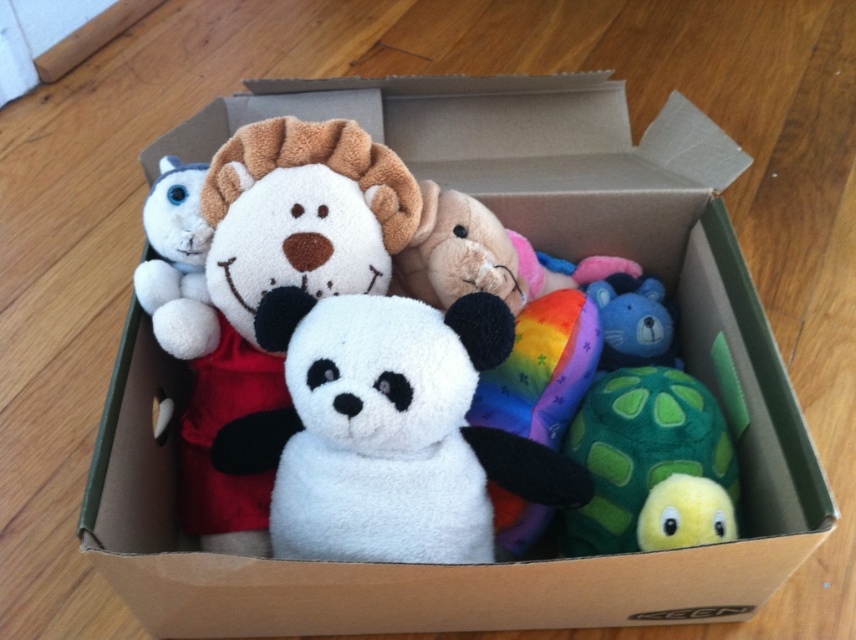
Question: Can you confirm if green fuzzy turtle at lower right is positioned to the left of blue plush bear at center?

Choices:
 (A) no
 (B) yes

Answer: (B)

Question: Considering the relative positions of green fuzzy turtle at lower right and blue plush bear at center in the image provided, where is green fuzzy turtle at lower right located with respect to blue plush bear at center?

Choices:
 (A) left
 (B) right

Answer: (A)

Question: Which object is the farthest from the fluffy white teddy bear at center?

Choices:
 (A) white plush panda at center
 (B) blue plush bear at center
 (C) yellow fuzzy bird at lower right
 (D) green fuzzy turtle at lower right

Answer: (C)

Question: Does fluffy white teddy bear at center have a greater width compared to blue plush bear at center?

Choices:
 (A) yes
 (B) no

Answer: (A)

Question: Which object is the farthest from the green fuzzy turtle at lower right?

Choices:
 (A) yellow fuzzy bird at lower right
 (B) white plush cat at upper left

Answer: (B)

Question: Which object appears closest to the camera in this image?

Choices:
 (A) white plush cat at upper left
 (B) blue plush bear at center
 (C) white plush panda at center
 (D) fluffy white teddy bear at center

Answer: (C)